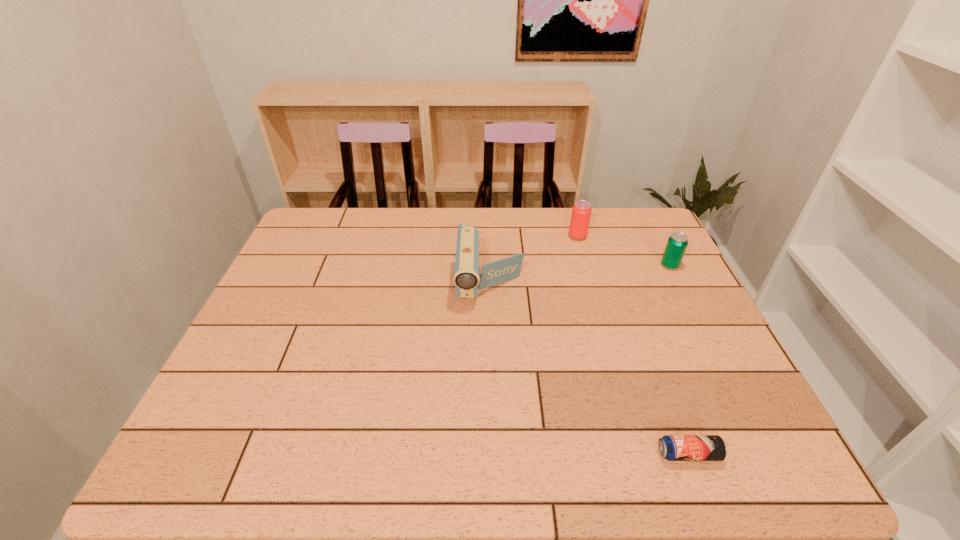
This screenshot has width=960, height=540. Identify the location of vacant space situated on the back of the nearest object. (634, 307).

Where is `object situated at the far edge`? object situated at the far edge is located at coordinates (581, 212).

Image resolution: width=960 pixels, height=540 pixels. Identify the location of object that is at the near edge. (671, 447).

Find the location of `object that is at the near right corner`. object that is at the near right corner is located at coordinates (671, 447).

The height and width of the screenshot is (540, 960). In the image, there is a desktop. Identify the location of blank space at the far edge. (379, 214).

This screenshot has height=540, width=960. In order to click on vacant space at the near edge of the desktop in this screenshot , I will do `click(372, 450)`.

The image size is (960, 540). In the image, there is a desktop. In order to click on vacant space at the left edge in this screenshot , I will do `click(317, 310)`.

I want to click on vacant space at the right edge of the desktop, so click(x=700, y=328).

In order to click on vacant space at the far right corner in this screenshot , I will do (642, 223).

Where is `vacant point located between the third object from right to left and the rightmost object`? vacant point located between the third object from right to left and the rightmost object is located at coordinates (624, 251).